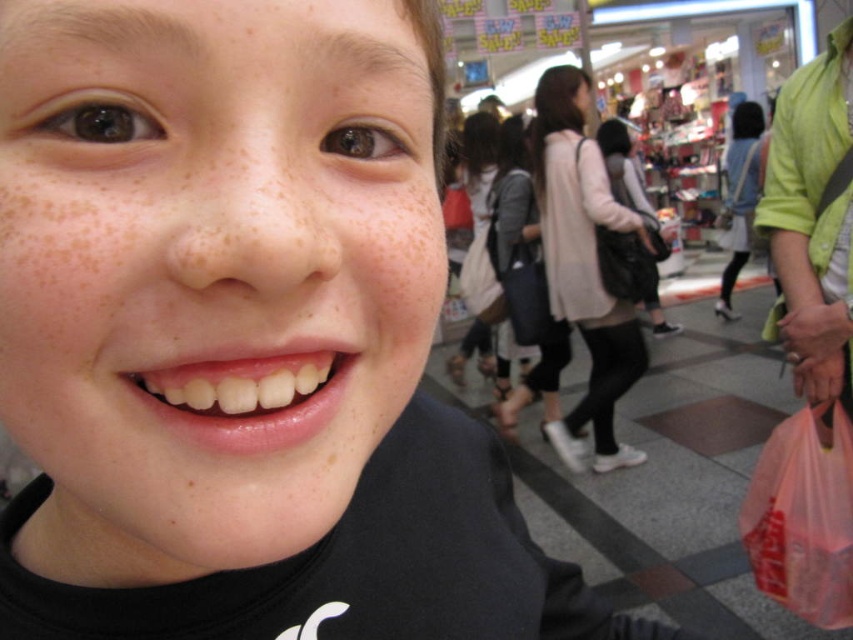
Question: Is light pink fabric bag at center bigger than pink plastic bag at lower right?

Choices:
 (A) no
 (B) yes

Answer: (B)

Question: Can you confirm if light pink fabric bag at center is positioned above pink plastic bag at lower right?

Choices:
 (A) no
 (B) yes

Answer: (B)

Question: Which point is farther to the camera?

Choices:
 (A) light pink fabric bag at center
 (B) pink plastic bag at lower right

Answer: (A)

Question: Which point is closer to the camera?

Choices:
 (A) pink plastic bag at lower right
 (B) light pink fabric bag at center

Answer: (A)

Question: Does light pink fabric bag at center have a larger size compared to pink plastic bag at lower right?

Choices:
 (A) yes
 (B) no

Answer: (A)